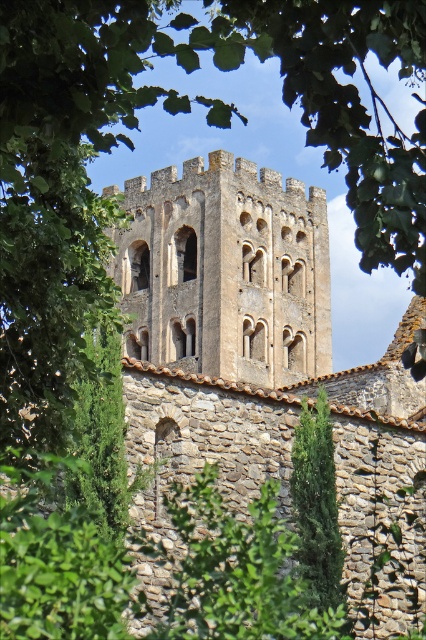
Question: Can you confirm if brown stone tower at center is smaller than green textured stone tower at center?

Choices:
 (A) yes
 (B) no

Answer: (B)

Question: Is brown stone tower at center smaller than green textured stone tower at center?

Choices:
 (A) no
 (B) yes

Answer: (A)

Question: Which of the following is the closest to the observer?

Choices:
 (A) brown stone tower at center
 (B) green textured stone tower at center

Answer: (B)

Question: Is brown stone tower at center closer to the viewer compared to green textured stone tower at center?

Choices:
 (A) no
 (B) yes

Answer: (A)

Question: Which of the following is the farthest from the observer?

Choices:
 (A) (207, 227)
 (B) (333, 605)

Answer: (A)